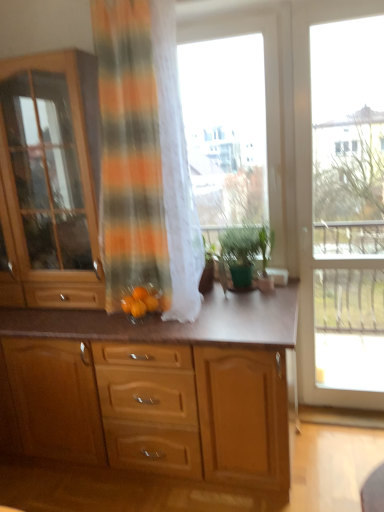
Question: From the image's perspective, relative to wooden cabinet at center, which is the 2th cabinetry from top to bottom, is orange striped fabric at center above or below?

Choices:
 (A) above
 (B) below

Answer: (A)

Question: Is orange striped fabric at center in front of or behind wooden cabinet at center, marked as the first cabinetry in a bottom-to-top arrangement, in the image?

Choices:
 (A) behind
 (B) front

Answer: (B)

Question: Which object is the closest to the orange matte tangerine at center, the second tangerine positioned from the left?

Choices:
 (A) green matte plant at center
 (B) green matte plant at center
 (C) wooden cabinet at center, which is the 2th cabinetry from top to bottom
 (D) white wood window frame at center
 (E) transparent glass window at center, which ranks as the first window in left-to-right order

Answer: (A)

Question: Which object is the farthest from the transparent glass door at right, which ranks as the first window in right-to-left order?

Choices:
 (A) white wood window frame at center
 (B) green matte plant at center
 (C) orange striped fabric at center
 (D) green matte plant at center
 (E) wooden cabinet at center, marked as the first cabinetry in a bottom-to-top arrangement

Answer: (E)